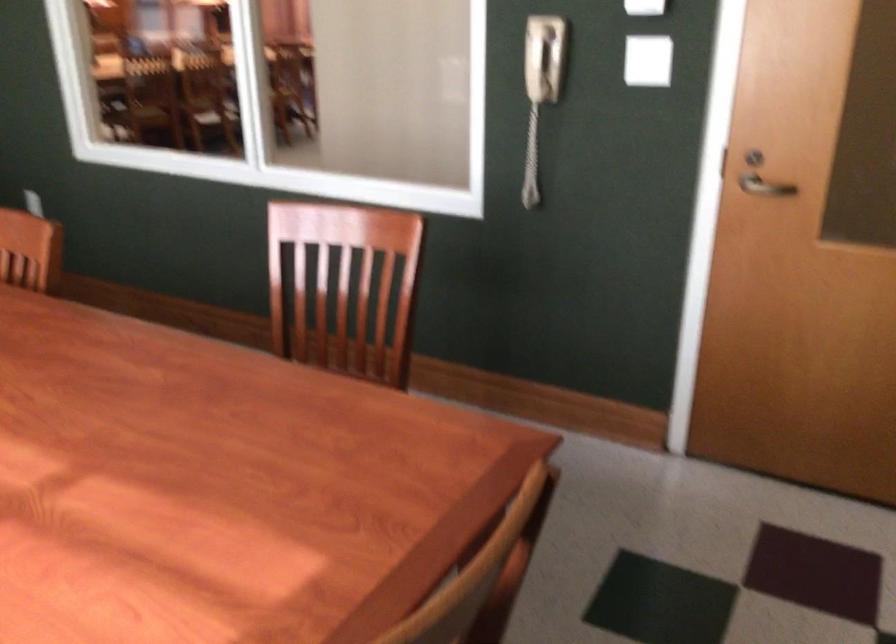
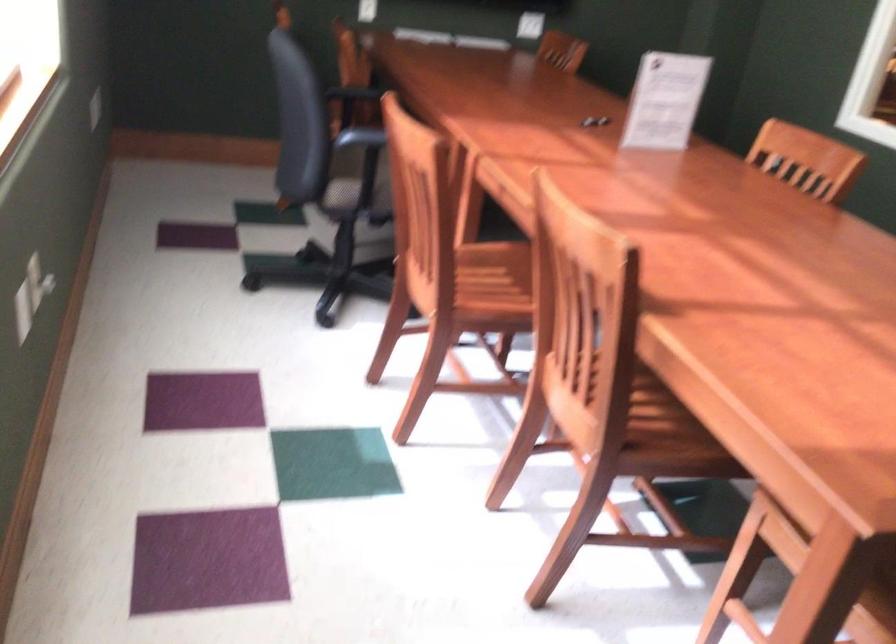
Question: How did the camera likely rotate?

Choices:
 (A) Left
 (B) Right
 (C) Up
 (D) Down

Answer: (A)